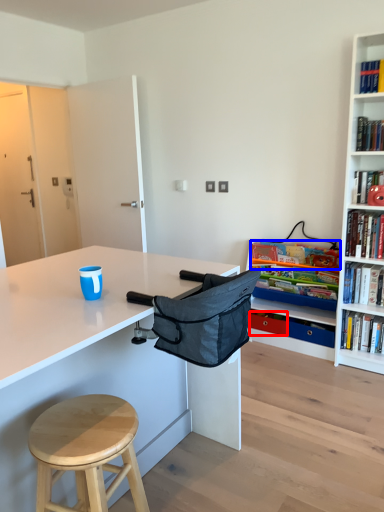
Question: Which point is closer to the camera, drawer (highlighted by a red box) or book (highlighted by a blue box)?

Choices:
 (A) drawer
 (B) book

Answer: (B)